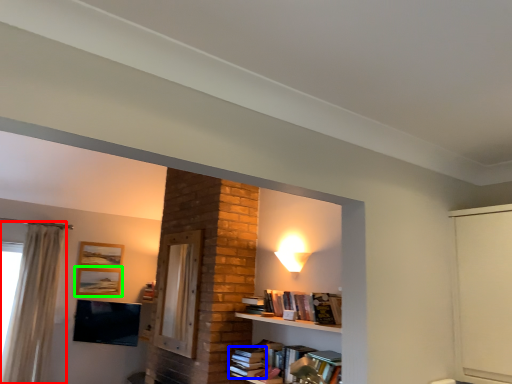
Question: Considering the real-world distances, which object is closest to curtain (highlighted by a red box)? book (highlighted by a blue box) or picture frame (highlighted by a green box).

Choices:
 (A) book
 (B) picture frame

Answer: (B)